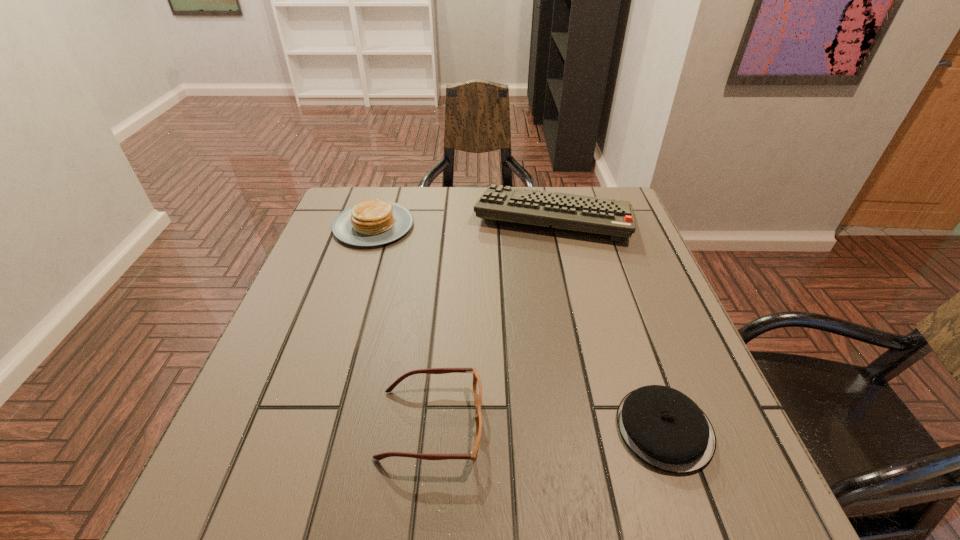
Identify the location of free space that satisfies the following two spatial constraints: 1. on the front side of the farther pancake; 2. on the left side of the nearer pancake. (309, 429).

Find the location of a particular element. This screenshot has height=540, width=960. vacant position in the image that satisfies the following two spatial constraints: 1. on the front side of the nearer pancake; 2. on the right side of the computer keyboard is located at coordinates (602, 429).

In order to click on free space that satisfies the following two spatial constraints: 1. on the back side of the shorter pancake; 2. on the front-facing side of the spectacles in this screenshot , I will do tap(662, 424).